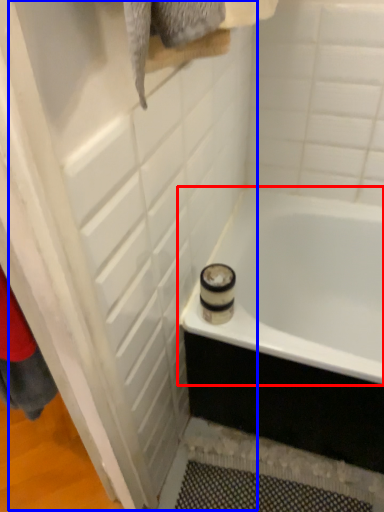
Question: Which object appears farthest to the camera in this image, bathtub (highlighted by a red box) or screen door (highlighted by a blue box)?

Choices:
 (A) bathtub
 (B) screen door

Answer: (A)